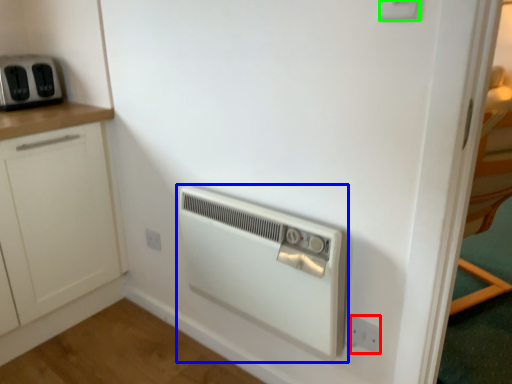
Question: Which object is the closest to the electric outlet (highlighted by a red box)? Choose among these: home appliance (highlighted by a blue box) or electric outlet (highlighted by a green box).

Choices:
 (A) home appliance
 (B) electric outlet

Answer: (A)